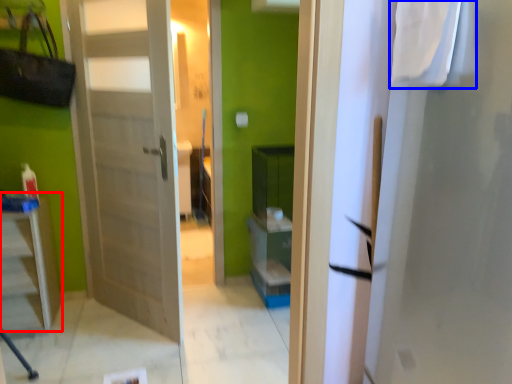
Question: Which object appears closest to the camera in this image, furniture (highlighted by a red box) or laundry (highlighted by a blue box)?

Choices:
 (A) furniture
 (B) laundry

Answer: (B)